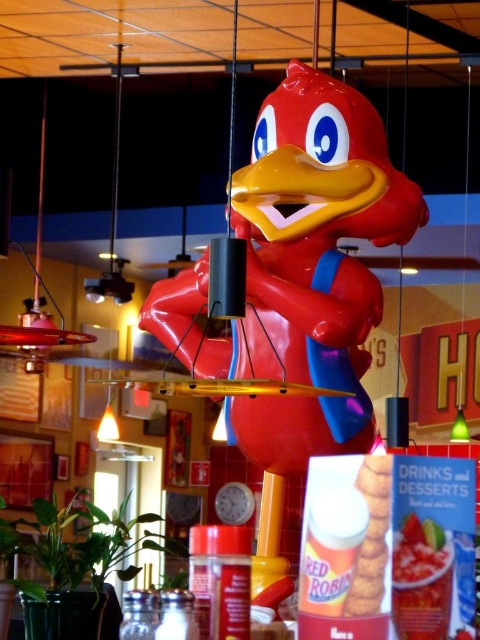
Question: Estimate the real-world distances between objects in this image. Which object is farther from the matte plastic french fries at center?

Choices:
 (A) glossy plastic salsa cup at lower center
 (B) shiny plastic duck at center

Answer: (B)

Question: Is shiny plastic duck at center positioned behind glossy plastic salsa cup at lower center?

Choices:
 (A) no
 (B) yes

Answer: (B)

Question: Can you confirm if shiny plastic duck at center is bigger than glossy plastic salsa cup at lower center?

Choices:
 (A) yes
 (B) no

Answer: (A)

Question: Which of the following is the farthest from the observer?

Choices:
 (A) (180, 284)
 (B) (377, 493)

Answer: (A)

Question: Can you confirm if glossy plastic salsa cup at lower center is positioned above matte plastic french fries at center?

Choices:
 (A) yes
 (B) no

Answer: (B)

Question: Among these points, which one is nearest to the camera?

Choices:
 (A) (288, 289)
 (B) (439, 548)
 (C) (385, 460)

Answer: (B)